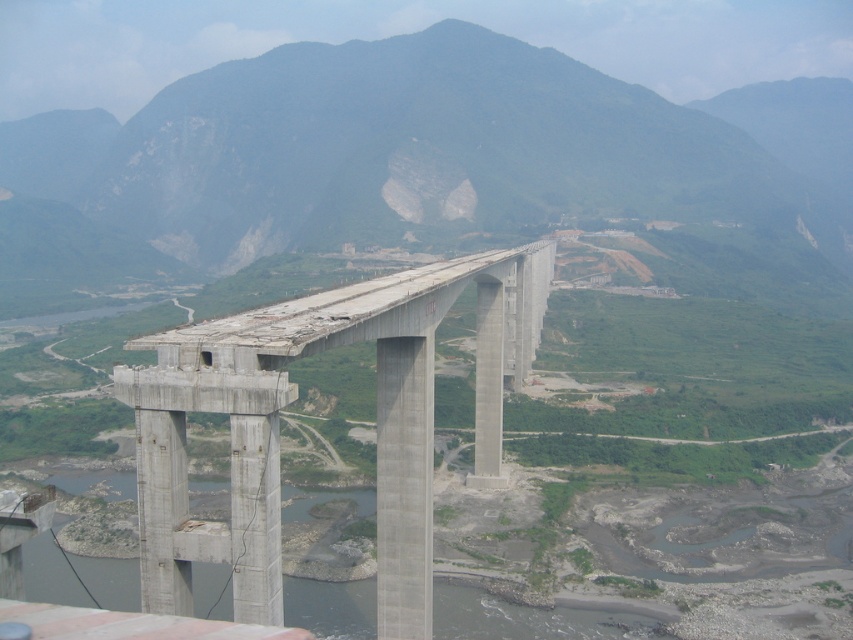
You are an engineer inspecting a construction site. You need to determine if the concrete bridge at center can accommodate a truck that requires a minimum of 10 meters of width. Given that the gray concrete river at lower center is wider than the bridge, can you estimate the bridge width based on the river width?

The concrete bridge at center is narrower than the gray concrete river at lower center. Since the river is wider, the bridge is less than the river width. However, without knowing the exact width of the river, we cannot determine if the bridge meets the truck requirement of 10 meters.

You are a construction worker standing at the base of the green rock mountain at center. You need to reach the gray concrete river at lower center to collect water. Which direction should you move to reach the river?

The green rock mountain at center is located above the gray concrete river at lower center, so you should move downward to reach the river.